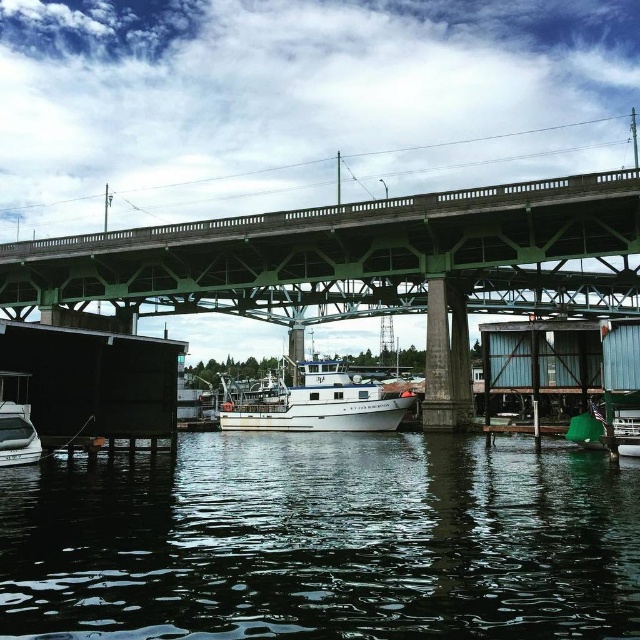
Between transparent water at lower center and white matte boat at center, which one appears on the right side from the viewer's perspective?

transparent water at lower center

Can you confirm if transparent water at lower center is positioned above white matte boat at center?

No, transparent water at lower center is not above white matte boat at center.

At what (x,y) coordinates should I click in order to perform the action: click on transparent water at lower center. Please return your answer as a coordinate pair (x, y). The image size is (640, 640). Looking at the image, I should click on (323, 541).

Is green concrete bridge at center bigger than white matte boat at center?

Indeed, green concrete bridge at center has a larger size compared to white matte boat at center.

Who is higher up, green concrete bridge at center or white matte boat at center?

green concrete bridge at center is higher up.

Locate an element on the screen. The height and width of the screenshot is (640, 640). green concrete bridge at center is located at coordinates (364, 266).

Which is in front, point (61, 518) or point (248, 275)?

Positioned in front is point (61, 518).

Who is more distant from viewer, (436, 442) or (465, 355)?

Point (465, 355)

The image size is (640, 640). Identify the location of transparent water at lower center. (323, 541).